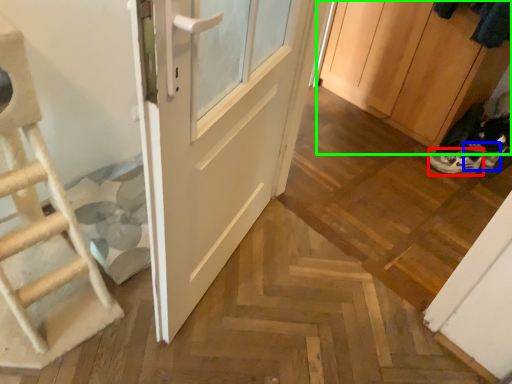
Question: Based on their relative distances, which object is farther from footwear (highlighted by a red box)? Choose from shoe (highlighted by a blue box) and cabinetry (highlighted by a green box).

Choices:
 (A) shoe
 (B) cabinetry

Answer: (B)